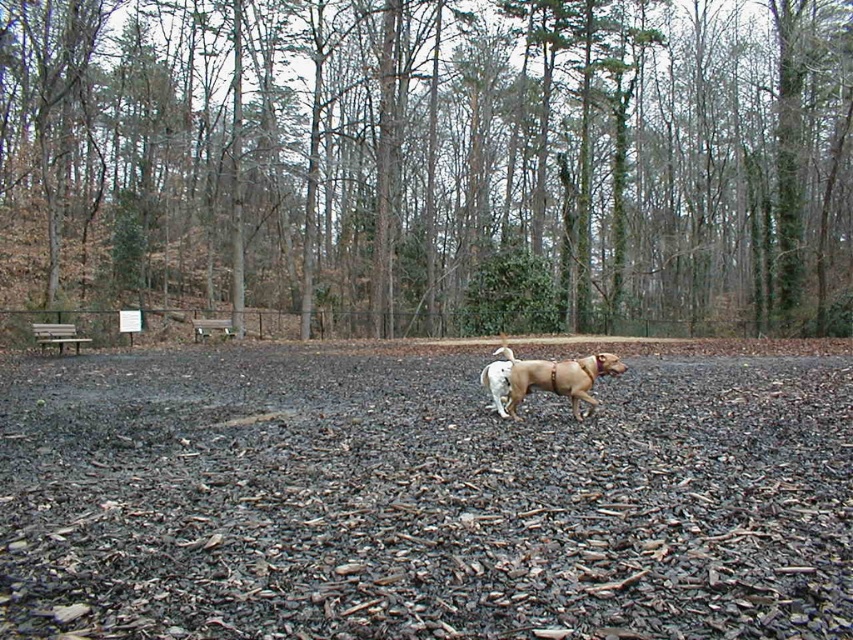
Consider the image. Can you confirm if dark brown mulch at center is bigger than golden brown leather dog at center?

Correct, dark brown mulch at center is larger in size than golden brown leather dog at center.

I want to click on dark brown mulch at center, so click(x=421, y=499).

Can you confirm if green leafy tree at center is positioned above dark brown mulch at center?

Indeed, green leafy tree at center is positioned over dark brown mulch at center.

Find the location of a particular element. This screenshot has width=853, height=640. green leafy tree at center is located at coordinates (432, 161).

What do you see at coordinates (432, 161) in the screenshot? I see `green leafy tree at center` at bounding box center [432, 161].

You are a GUI agent. You are given a task and a screenshot of the screen. Output one action in this format:
    pyautogui.click(x=<x>, y=<y>)
    Task: Click on the green leafy tree at center
    This screenshot has width=853, height=640.
    Given the screenshot: What is the action you would take?
    pyautogui.click(x=432, y=161)

How much distance is there between dark brown mulch at center and brown wooden bench at center?

dark brown mulch at center is 51.91 feet from brown wooden bench at center.

Between point (36, 538) and point (227, 321), which one is positioned in front?

Positioned in front is point (36, 538).

The width and height of the screenshot is (853, 640). Describe the element at coordinates (421, 499) in the screenshot. I see `dark brown mulch at center` at that location.

Where is `dark brown mulch at center`? dark brown mulch at center is located at coordinates (421, 499).